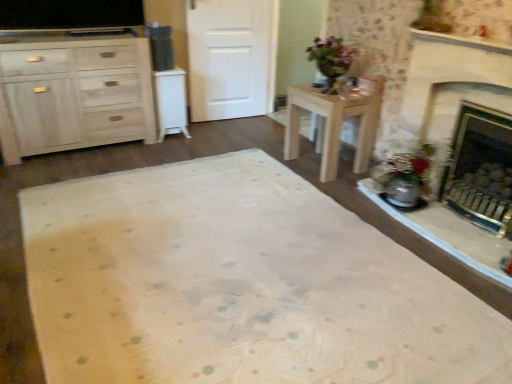
Question: Is white matte door at center spatially inside brass fireplace at right, or outside of it?

Choices:
 (A) inside
 (B) outside

Answer: (B)

Question: In terms of size, does white matte door at center appear bigger or smaller than brass fireplace at right?

Choices:
 (A) small
 (B) big

Answer: (A)

Question: Which object is positioned farthest from the white matte door at center?

Choices:
 (A) white matte cabinet at left, positioned as the 2th cabinetry in left-to-right order
 (B) light wood cabinet at left, arranged as the second cabinetry when viewed from the right
 (C) brass fireplace at right
 (D) light wood desk at center

Answer: (C)

Question: Which object is the closest to the white matte cabinet at left, marked as the 1th cabinetry in a right-to-left arrangement?

Choices:
 (A) brass fireplace at right
 (B) light wood desk at center
 (C) white matte door at center
 (D) light wood cabinet at left, arranged as the second cabinetry when viewed from the right

Answer: (D)